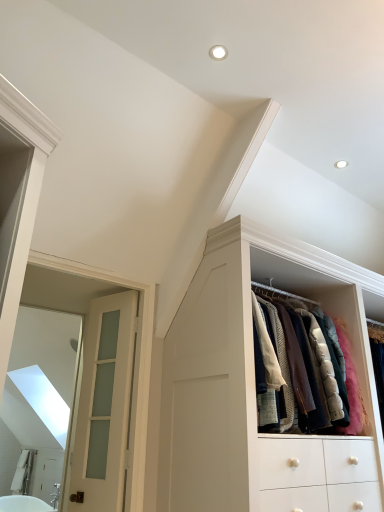
Question: Is white frosted glass door at left positioned with its back to white glossy bathtub at lower left?

Choices:
 (A) yes
 (B) no

Answer: (B)

Question: Is white frosted glass door at left taller than white glossy bathtub at lower left?

Choices:
 (A) yes
 (B) no

Answer: (A)

Question: Is white frosted glass door at left to the right of white glossy bathtub at lower left from the viewer's perspective?

Choices:
 (A) yes
 (B) no

Answer: (A)

Question: Is white frosted glass door at left behind white glossy bathtub at lower left?

Choices:
 (A) no
 (B) yes

Answer: (A)

Question: Considering the relative sizes of white frosted glass door at left and white glossy bathtub at lower left in the image provided, is white frosted glass door at left bigger than white glossy bathtub at lower left?

Choices:
 (A) yes
 (B) no

Answer: (B)

Question: Would you say white frosted glass door at left is inside or outside white glossy bathtub at lower left?

Choices:
 (A) inside
 (B) outside

Answer: (B)

Question: Would you say white frosted glass door at left is to the left or to the right of white glossy bathtub at lower left in the picture?

Choices:
 (A) right
 (B) left

Answer: (A)

Question: In terms of size, does white frosted glass door at left appear bigger or smaller than white glossy bathtub at lower left?

Choices:
 (A) big
 (B) small

Answer: (B)

Question: From the image's perspective, is white frosted glass door at left located above or below white glossy bathtub at lower left?

Choices:
 (A) below
 (B) above

Answer: (B)

Question: Considering the positions of white frosted glass door at left and white wood cabinet at upper right in the image, is white frosted glass door at left bigger or smaller than white wood cabinet at upper right?

Choices:
 (A) big
 (B) small

Answer: (B)

Question: From a real-world perspective, is white frosted glass door at left positioned above or below white wood cabinet at upper right?

Choices:
 (A) below
 (B) above

Answer: (A)

Question: Is white frosted glass door at left wider or thinner than white wood cabinet at upper right?

Choices:
 (A) wide
 (B) thin

Answer: (B)

Question: Relative to white wood cabinet at upper right, is white frosted glass door at left in front or behind?

Choices:
 (A) behind
 (B) front

Answer: (A)

Question: From the image's perspective, relative to white frosted glass door at left, is white wood cabinet at upper right above or below?

Choices:
 (A) below
 (B) above

Answer: (B)

Question: Is point (375, 411) closer or farther from the camera than point (81, 440)?

Choices:
 (A) farther
 (B) closer

Answer: (B)